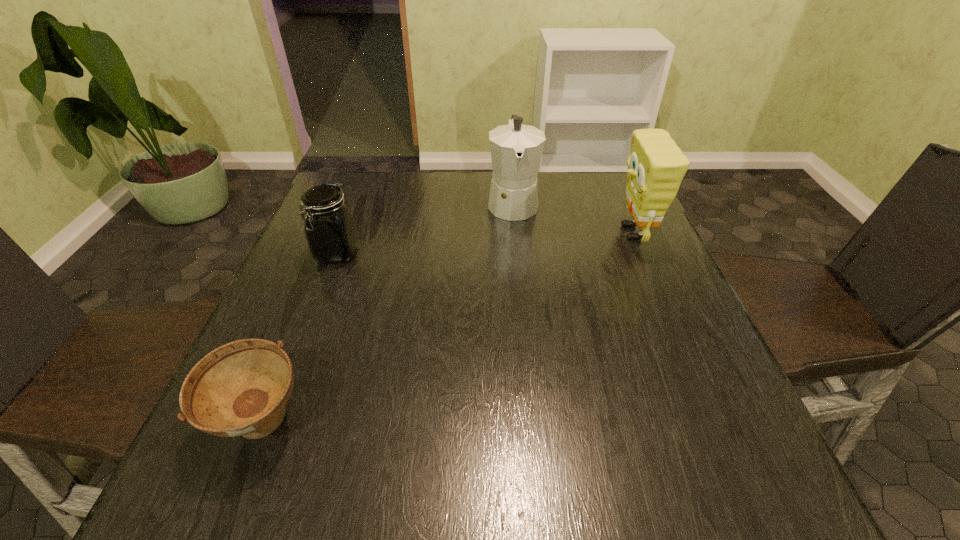
This screenshot has width=960, height=540. I want to click on coffeepot, so pos(516,150).

Locate an element on the screen. The image size is (960, 540). sponge is located at coordinates (656, 165).

At what (x,y) coordinates should I click in order to perform the action: click on the second shortest object. Please return your answer as a coordinate pair (x, y). This screenshot has height=540, width=960. Looking at the image, I should click on (329, 226).

I want to click on the nearest object, so click(x=239, y=389).

At what (x,y) coordinates should I click in order to perform the action: click on soup bowl. Please return your answer as a coordinate pair (x, y). The height and width of the screenshot is (540, 960). Looking at the image, I should click on (239, 389).

This screenshot has height=540, width=960. What are the coordinates of `free space located at the spout of the third object from left to right` in the screenshot? It's located at (522, 301).

At what (x,y) coordinates should I click in order to perform the action: click on free space located on the face of the rightmost object. Please return your answer as a coordinate pair (x, y). The width and height of the screenshot is (960, 540). Looking at the image, I should click on (461, 233).

At what (x,y) coordinates should I click in order to perform the action: click on vacant point located on the face of the rightmost object. Please return your answer as a coordinate pair (x, y). This screenshot has width=960, height=540. Looking at the image, I should click on (527, 233).

Locate an element on the screen. The image size is (960, 540). vacant region located on the face of the rightmost object is located at coordinates (492, 233).

This screenshot has height=540, width=960. Find the location of `blank area located on the lid of the jar`. blank area located on the lid of the jar is located at coordinates (316, 310).